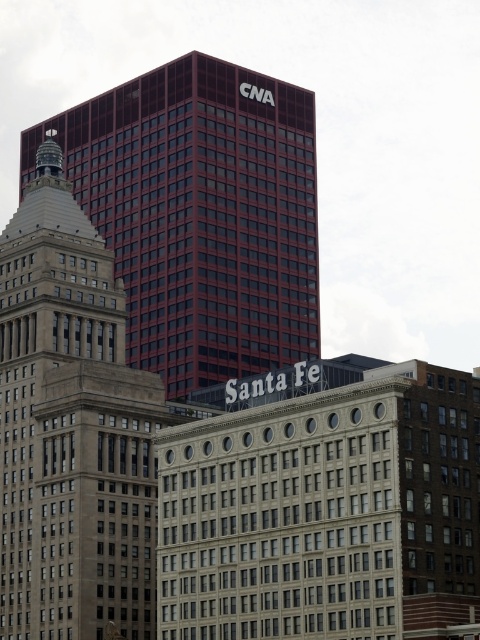
Question: Among these objects, which one is nearest to the camera?

Choices:
 (A) maroon glass building at center
 (B) beige stone tower at center

Answer: (B)

Question: Among these points, which one is nearest to the camera?

Choices:
 (A) (66, 211)
 (B) (237, 99)

Answer: (A)

Question: In this image, where is maroon glass building at center located relative to beige stone tower at center?

Choices:
 (A) right
 (B) left

Answer: (A)

Question: Is maroon glass building at center wider than beige stone tower at center?

Choices:
 (A) yes
 (B) no

Answer: (A)

Question: Can you confirm if maroon glass building at center is positioned to the left of beige stone tower at center?

Choices:
 (A) yes
 (B) no

Answer: (B)